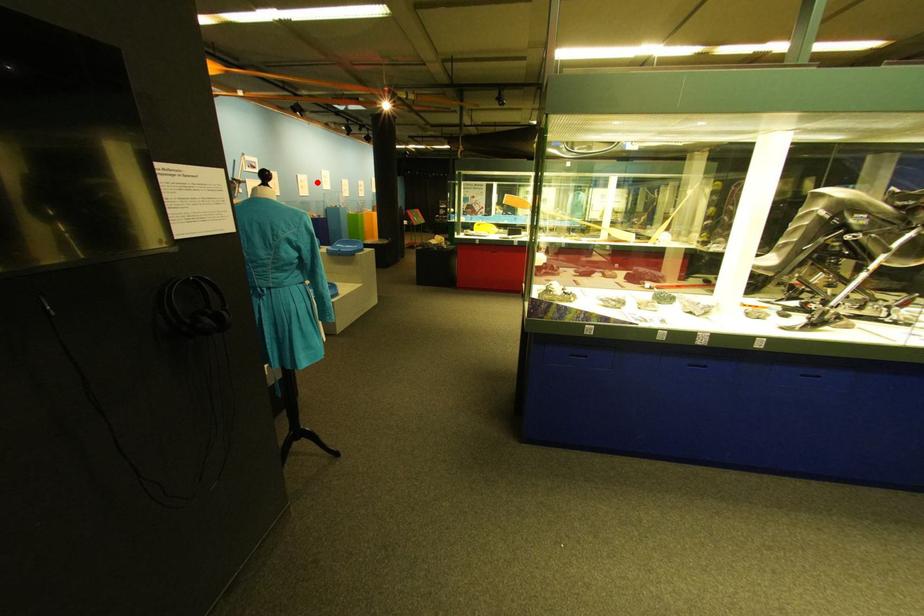
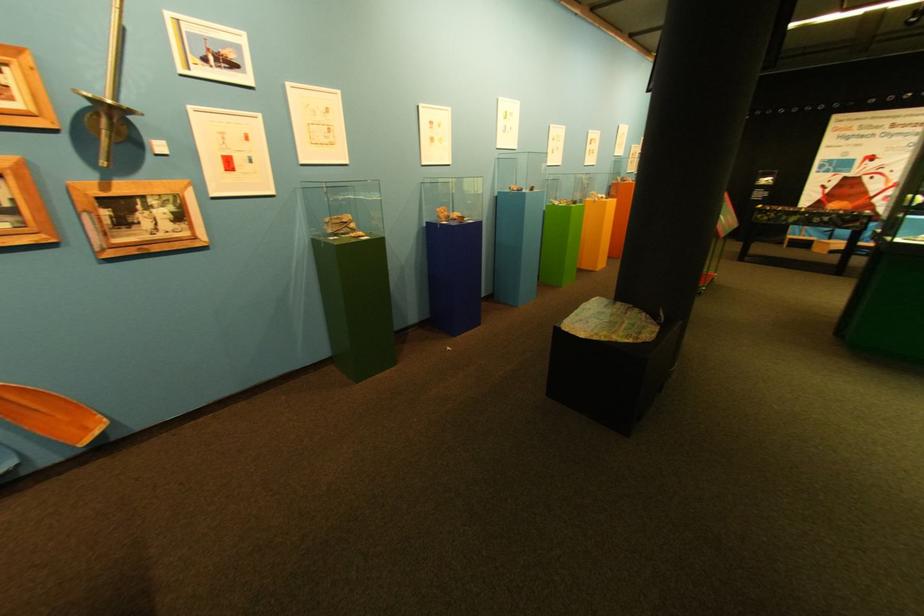
The point at the highlighted location is marked in the first image. Where is the corresponding point in the second image?

(445, 124)